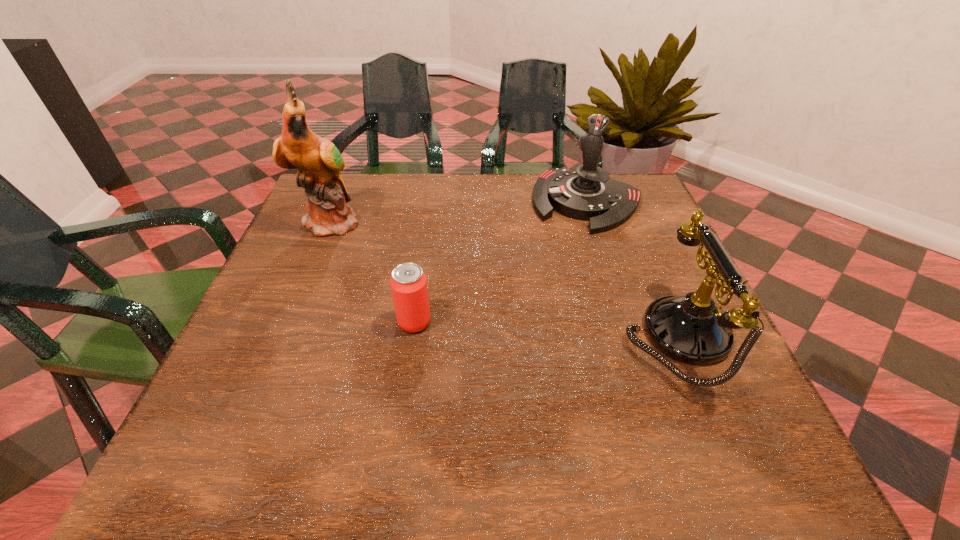
Identify the location of object situated at the far right corner. The image size is (960, 540). (588, 193).

Identify the location of object at the near right corner. (693, 329).

Identify the location of vacant space at the far edge. (536, 221).

The height and width of the screenshot is (540, 960). I want to click on free space at the left edge, so click(311, 352).

In the image, there is a desktop. Where is `blank space at the far left corner`? This screenshot has height=540, width=960. blank space at the far left corner is located at coordinates (354, 206).

You are a GUI agent. You are given a task and a screenshot of the screen. Output one action in this format:
    pyautogui.click(x=<x>, y=<y>)
    Task: Click on the vacant space at the near left corner of the desktop
    
    Given the screenshot: What is the action you would take?
    pyautogui.click(x=269, y=416)

Where is `vacant point at the near right corner`? vacant point at the near right corner is located at coordinates (714, 375).

Where is `free space between the shortest object and the parrot`? free space between the shortest object and the parrot is located at coordinates (373, 271).

This screenshot has height=540, width=960. What are the coordinates of `empty location between the telephone and the joystick` in the screenshot? It's located at (632, 269).

The height and width of the screenshot is (540, 960). I want to click on free space that is in between the joystick and the telephone, so 632,269.